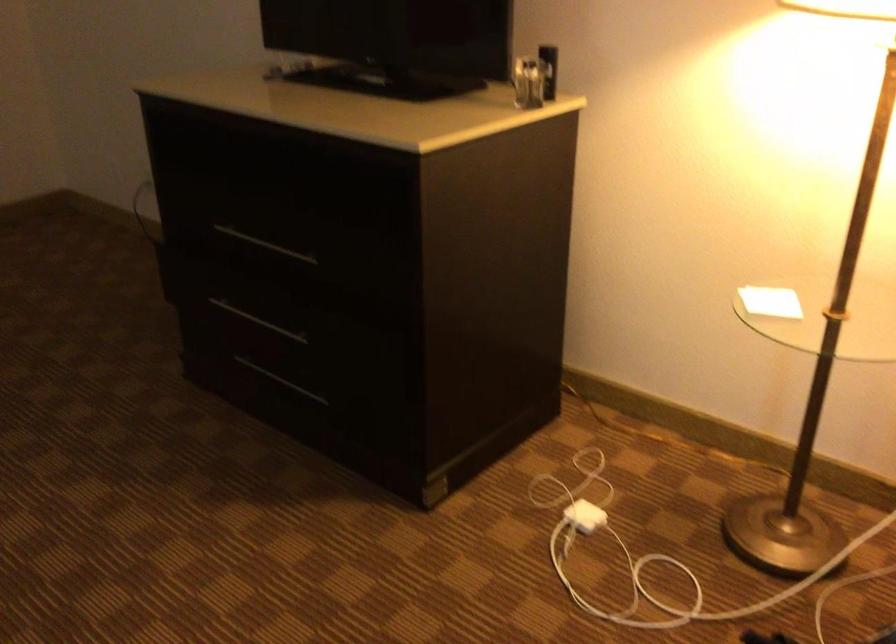
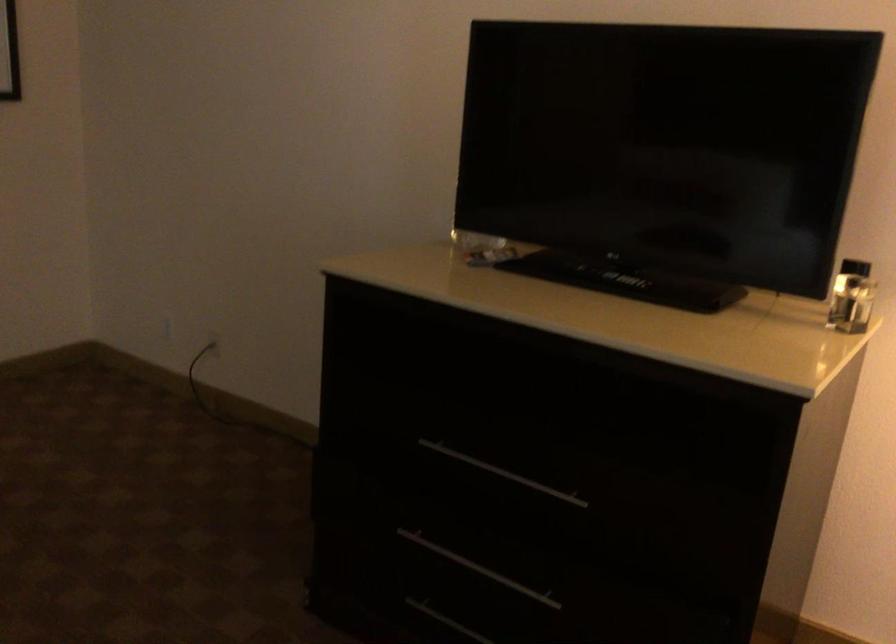
Locate, in the second image, the point that corresponds to point 266,243 in the first image.

(502, 473)